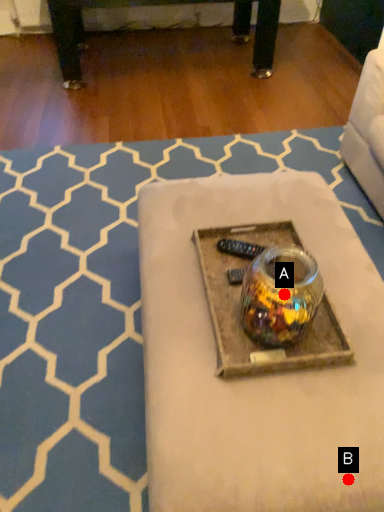
Question: Two points are circled on the image, labeled by A and B beside each circle. Which point is further to the camera?

Choices:
 (A) A is further
 (B) B is further

Answer: (A)